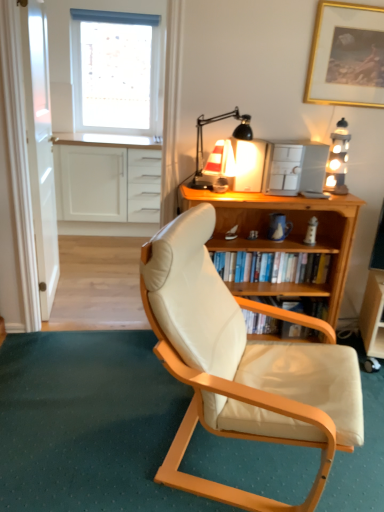
Where is `free point to the right of transparent glass door at left`? This screenshot has width=384, height=512. free point to the right of transparent glass door at left is located at coordinates (99, 293).